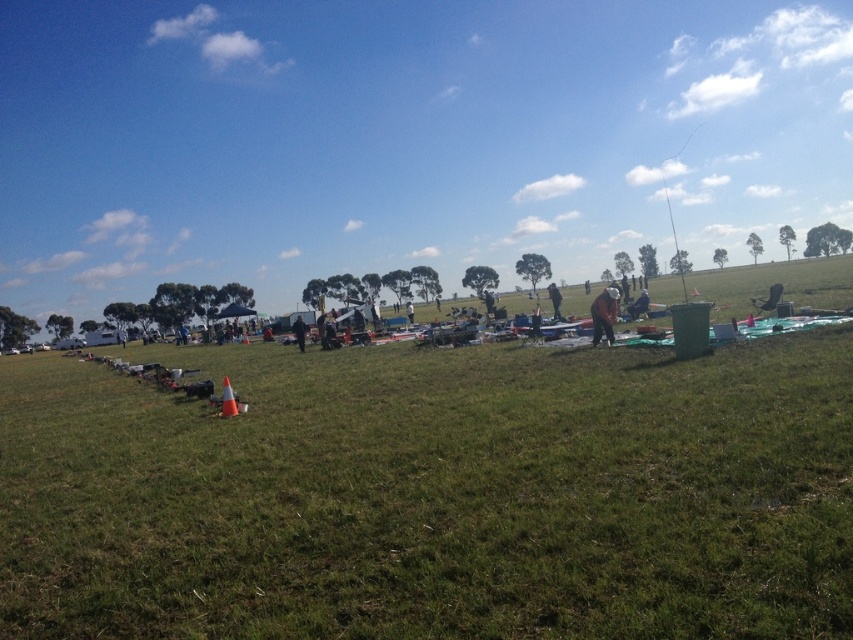
Question: Is green grass at center thinner than brown leather jacket at center-right?

Choices:
 (A) no
 (B) yes

Answer: (A)

Question: Is dark blue jacket at center further to camera compared to brown leather jacket at center-right?

Choices:
 (A) yes
 (B) no

Answer: (B)

Question: Which point is farther from the camera taking this photo?

Choices:
 (A) (297, 317)
 (B) (198, 449)
 (C) (556, 316)

Answer: (A)

Question: Which object is positioned farthest from the brown fabric jacket at center-right?

Choices:
 (A) green grass at center
 (B) dark gray fabric jacket at right
 (C) dark blue jacket at center

Answer: (C)

Question: Which point is closer to the camera taking this photo?

Choices:
 (A) (606, 330)
 (B) (300, 344)
 (C) (550, 292)

Answer: (A)

Question: From the image, what is the correct spatial relationship of brown fabric jacket at center-right in relation to dark blue jacket at center?

Choices:
 (A) left
 (B) right

Answer: (B)